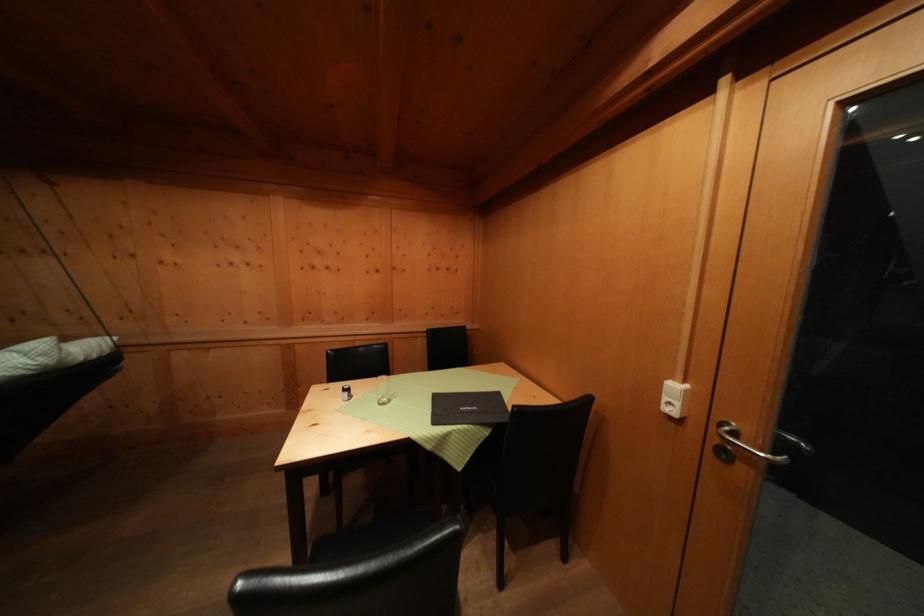
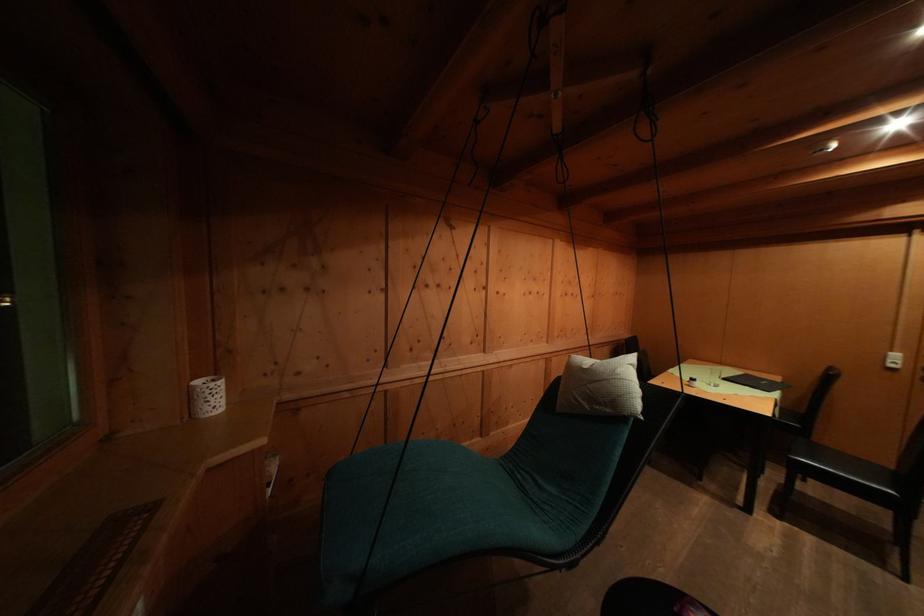
Question: What movement of the cameraman would produce the second image?

Choices:
 (A) Left
 (B) Right
 (C) Forward
 (D) Backward

Answer: (A)